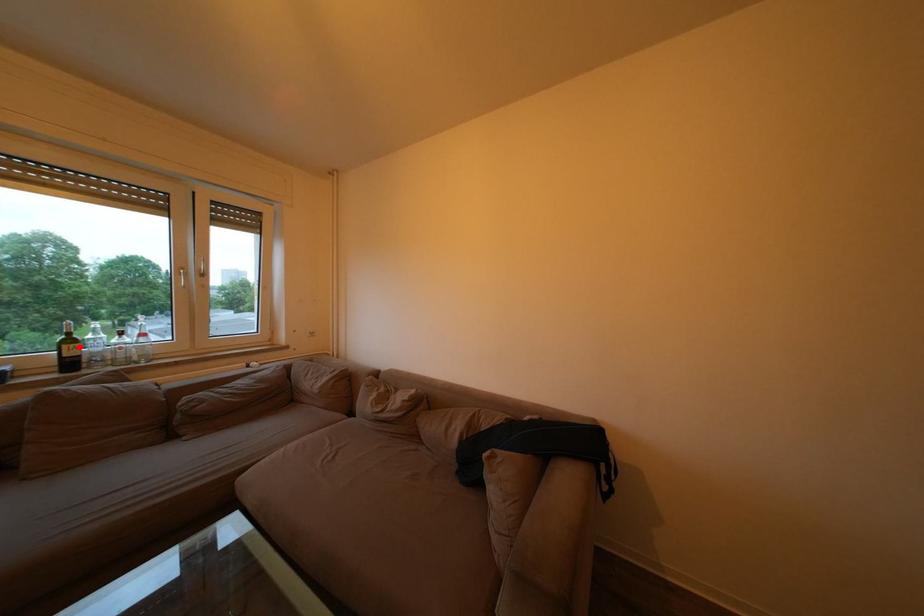
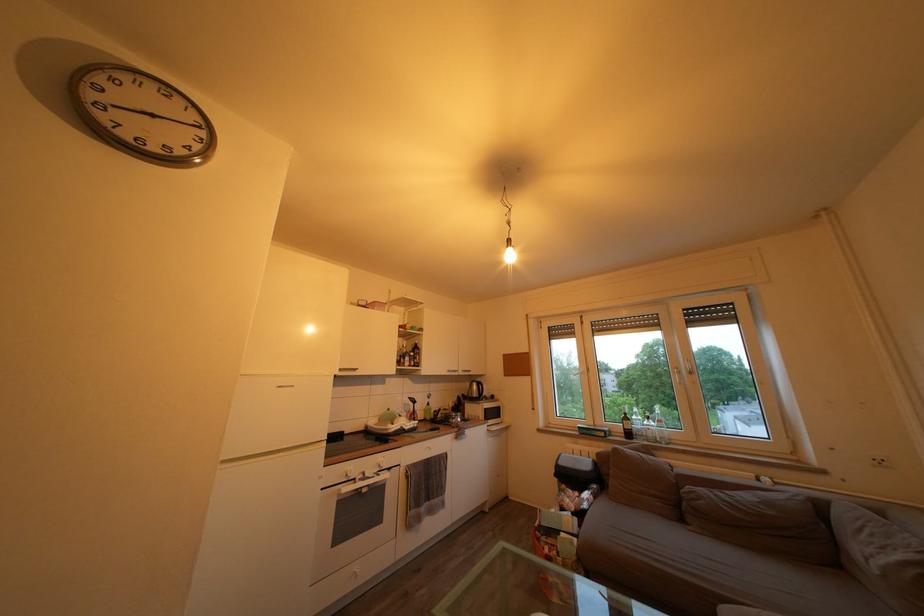
Question: I am providing you with two images of the same scene from different viewpoints. A red point is shown in image1. For the corresponding object point in image2, is it positioned nearer or farther from the camera?

Choices:
 (A) Nearer
 (B) Farther

Answer: (B)